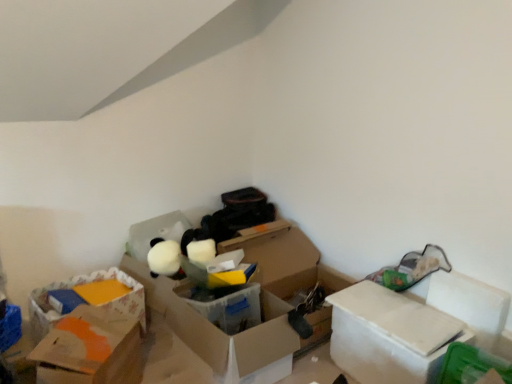
Question: Is cardboard box at left, placed as the 1th storage box when sorted from back to front, turned away from translucent plastic box at center, which ranks as the second box in left-to-right order?

Choices:
 (A) no
 (B) yes

Answer: (A)

Question: Does cardboard box at left, acting as the second storage box starting from the right, have a greater height compared to translucent plastic box at center, which ranks as the second box in left-to-right order?

Choices:
 (A) yes
 (B) no

Answer: (B)

Question: Is cardboard box at left, which is counted as the 1th storage box, starting from the left, directly adjacent to translucent plastic box at center, which ranks as the second box in left-to-right order?

Choices:
 (A) yes
 (B) no

Answer: (B)

Question: Would you say cardboard box at left, acting as the second storage box starting from the right, contains translucent plastic box at center, the second box positioned from the right?

Choices:
 (A) yes
 (B) no

Answer: (B)

Question: From the image's perspective, would you say cardboard box at left, marked as the second storage box in a front-to-back arrangement, is positioned over translucent plastic box at center, which ranks as the second box in left-to-right order?

Choices:
 (A) no
 (B) yes

Answer: (B)

Question: Is cardboard box at left, placed as the 1th storage box when sorted from back to front, wider than translucent plastic box at center, which ranks as the second box in left-to-right order?

Choices:
 (A) yes
 (B) no

Answer: (B)

Question: Can you confirm if translucent plastic box at center, which ranks as the second box in left-to-right order, is bigger than white cardboard box at right, the third box in the left-to-right sequence?

Choices:
 (A) no
 (B) yes

Answer: (B)

Question: Is the surface of translucent plastic box at center, the second box positioned from the right, in direct contact with white cardboard box at right, the 1th box positioned from the right?

Choices:
 (A) yes
 (B) no

Answer: (B)

Question: Is the position of translucent plastic box at center, the second box positioned from the right, more distant than that of white cardboard box at right, the third box in the left-to-right sequence?

Choices:
 (A) yes
 (B) no

Answer: (A)

Question: Does translucent plastic box at center, the second box positioned from the right, have a greater height compared to white cardboard box at right, the third box in the left-to-right sequence?

Choices:
 (A) yes
 (B) no

Answer: (B)

Question: Considering the relative sizes of translucent plastic box at center, which ranks as the second box in left-to-right order, and white cardboard box at right, the third box in the left-to-right sequence, in the image provided, is translucent plastic box at center, which ranks as the second box in left-to-right order, thinner than white cardboard box at right, the third box in the left-to-right sequence,?

Choices:
 (A) no
 (B) yes

Answer: (A)

Question: Does translucent plastic box at center, which ranks as the second box in left-to-right order, appear on the left side of white cardboard box at right, the third box in the left-to-right sequence?

Choices:
 (A) no
 (B) yes

Answer: (B)

Question: From the image's perspective, is white cardboard box at right, the third box in the left-to-right sequence, located above translucent plastic box at center, the second box positioned from the right?

Choices:
 (A) no
 (B) yes

Answer: (A)